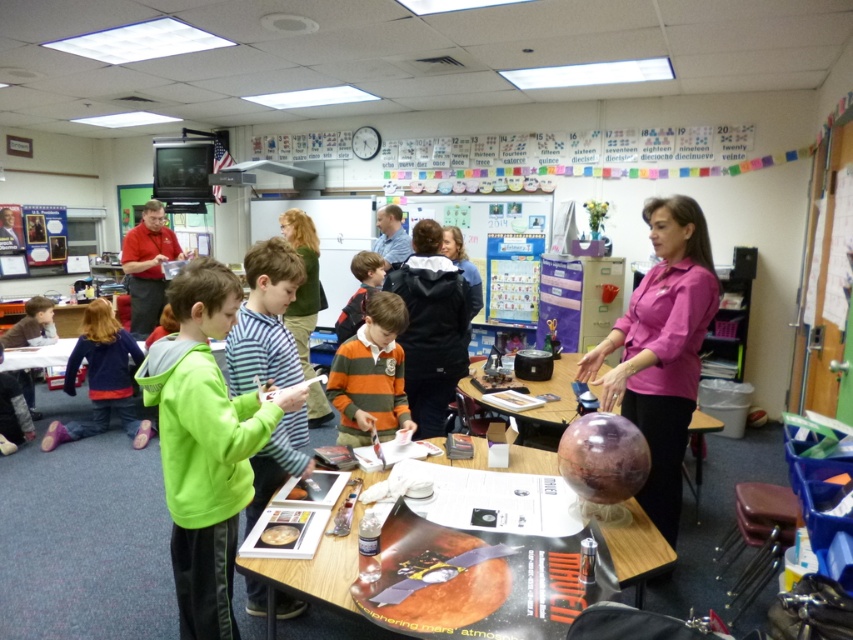
Is point (248, 369) farther from camera compared to point (241, 563)?

Yes, it is behind point (241, 563).

Image resolution: width=853 pixels, height=640 pixels. Identify the location of green striped sweater at center. (265, 320).

The height and width of the screenshot is (640, 853). What do you see at coordinates (265, 320) in the screenshot?
I see `green striped sweater at center` at bounding box center [265, 320].

This screenshot has width=853, height=640. Find the location of `green striped sweater at center`. green striped sweater at center is located at coordinates (265, 320).

Measure the distance from metallic silver table at center to purple fleece jacket at lower left.

3.15 meters

Between metallic silver table at center and purple fleece jacket at lower left, which one appears on the left side from the viewer's perspective?

From the viewer's perspective, purple fleece jacket at lower left appears more on the left side.

The height and width of the screenshot is (640, 853). Describe the element at coordinates (314, 572) in the screenshot. I see `metallic silver table at center` at that location.

Where is `metallic silver table at center`? This screenshot has width=853, height=640. metallic silver table at center is located at coordinates (314, 572).

In the scene shown: Is metallic silver table at center wider than striped cotton shirt at center?

Incorrect, metallic silver table at center's width does not surpass striped cotton shirt at center's.

Is metallic silver table at center in front of striped cotton shirt at center?

→ Yes, metallic silver table at center is closer to the viewer.

Between point (328, 589) and point (386, 387), which one is positioned in front?

Point (328, 589)

I want to click on metallic silver table at center, so click(314, 572).